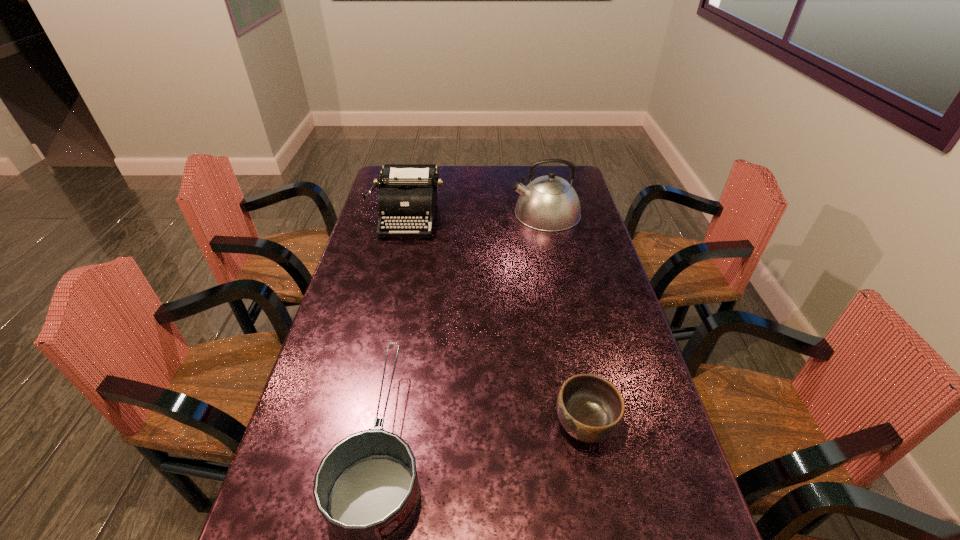
Image resolution: width=960 pixels, height=540 pixels. Identify the location of kettle. point(549,203).

At what (x,y) coordinates should I click in order to perform the action: click on the third shortest object. Please return your answer as a coordinate pair (x, y). Looking at the image, I should click on (408, 192).

This screenshot has height=540, width=960. Identify the location of bowl. (590, 408).

The image size is (960, 540). What are the coordinates of `free space located 0.270m from the spout of the kettle` in the screenshot? It's located at click(x=444, y=213).

Where is `blank space located from the spout of the kettle`? This screenshot has height=540, width=960. blank space located from the spout of the kettle is located at coordinates (469, 213).

This screenshot has width=960, height=540. I want to click on free space located 0.280m from the spout of the kettle, so click(442, 213).

Identify the location of free space located 0.110m on the typing side of the typewriter. This screenshot has width=960, height=540. (398, 258).

This screenshot has height=540, width=960. I want to click on vacant area located on the right of the bowl, so click(666, 424).

Locate an element on the screen. The width and height of the screenshot is (960, 540). object that is at the left edge is located at coordinates (408, 192).

You are a GUI agent. You are given a task and a screenshot of the screen. Output one action in this format:
    pyautogui.click(x=<x>, y=<y>)
    Task: Click on the kettle present at the right edge
    This screenshot has height=540, width=960.
    Given the screenshot: What is the action you would take?
    pyautogui.click(x=549, y=203)